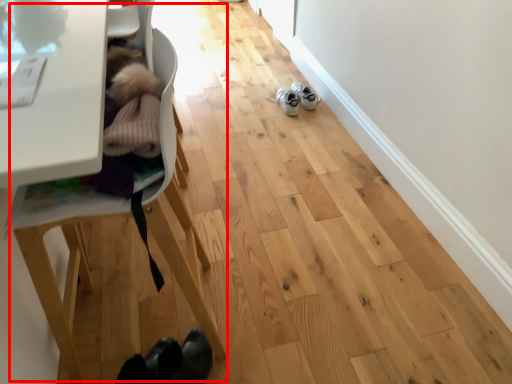
Question: From the image, what is the correct spatial relationship of baby carriage (annotated by the red box) in relation to footwear?

Choices:
 (A) left
 (B) right

Answer: (A)